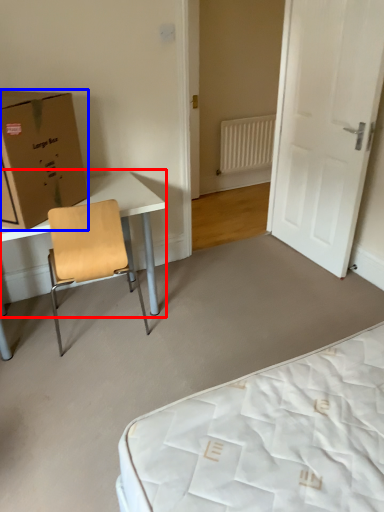
Question: Which object is further to the camera taking this photo, table (highlighted by a red box) or box (highlighted by a blue box)?

Choices:
 (A) table
 (B) box

Answer: (A)